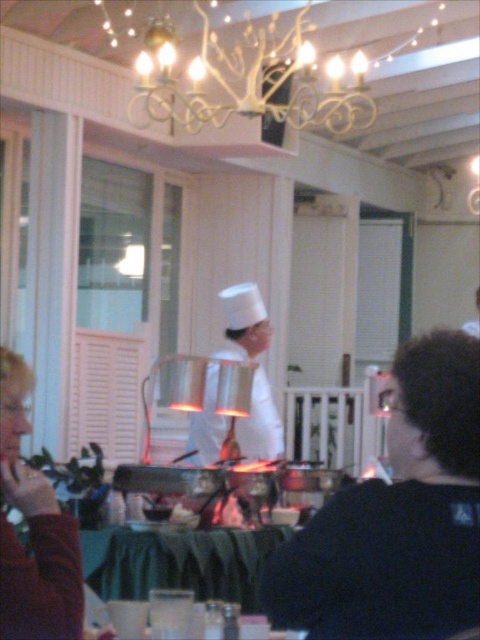
Question: Can you confirm if matte red sweater at lower left is positioned to the left of green fabric tablecloth at lower center?

Choices:
 (A) no
 (B) yes

Answer: (B)

Question: Does white wrought iron chandelier at upper center appear over green fabric tablecloth at lower center?

Choices:
 (A) yes
 (B) no

Answer: (A)

Question: Does white wrought iron chandelier at upper center appear on the left side of green fabric tablecloth at lower center?

Choices:
 (A) yes
 (B) no

Answer: (B)

Question: Which of the following is the closest to the observer?

Choices:
 (A) white chef hat at center
 (B) white matte chef hat at center

Answer: (A)

Question: Which point appears farthest from the camera in this image?

Choices:
 (A) (3, 365)
 (B) (257, 572)
 (C) (190, 90)
 (D) (399, 492)

Answer: (C)

Question: Which of the following is the farthest from the observer?

Choices:
 (A) (410, 428)
 (B) (165, 566)
 (C) (196, 424)

Answer: (C)